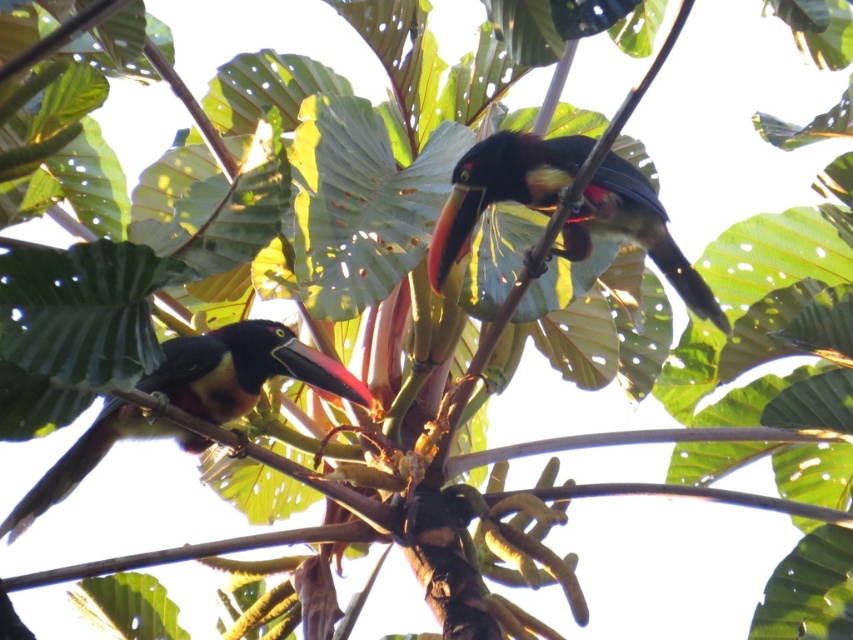
You are a birdwatcher trying to observe both toucans. If you want to get a clear view of both the shiny black toucan at center and the shiny black toucan at left, how far apart are they from each other?

The distance between the shiny black toucan at center and the shiny black toucan at left is 72.86 centimeters.

Based on the coordinates provided in the scene description, where exactly is the shiny black toucan at center located in the image?

The shiny black toucan at center is located at coordinates point [502,188].